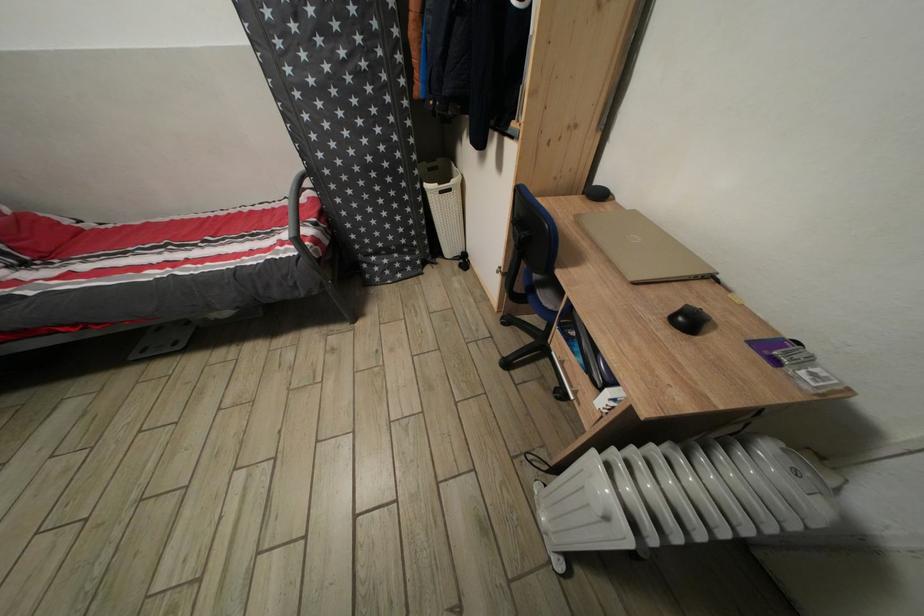
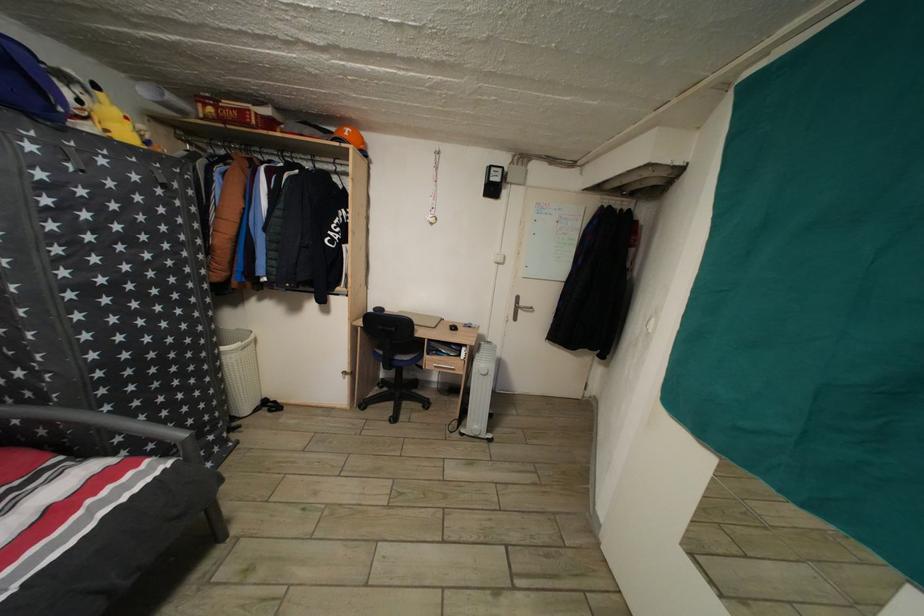
In the second image, find the point that corresponds to (575,345) in the first image.

(443, 361)